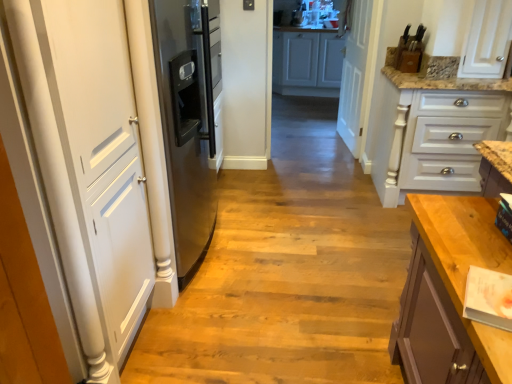
I want to click on vacant area on the back side of white wood door at center, which is the 2th door in left-to-right order, so click(x=322, y=127).